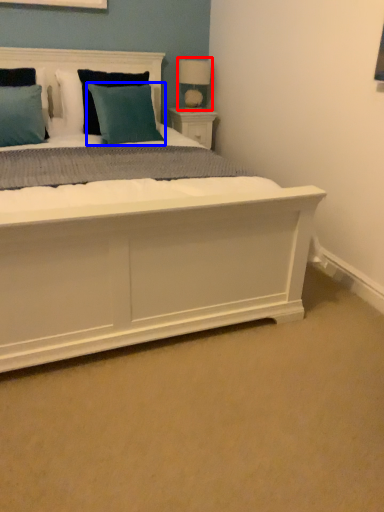
Question: Which point is closer to the camera, table lamp (highlighted by a red box) or pillow (highlighted by a blue box)?

Choices:
 (A) table lamp
 (B) pillow

Answer: (B)